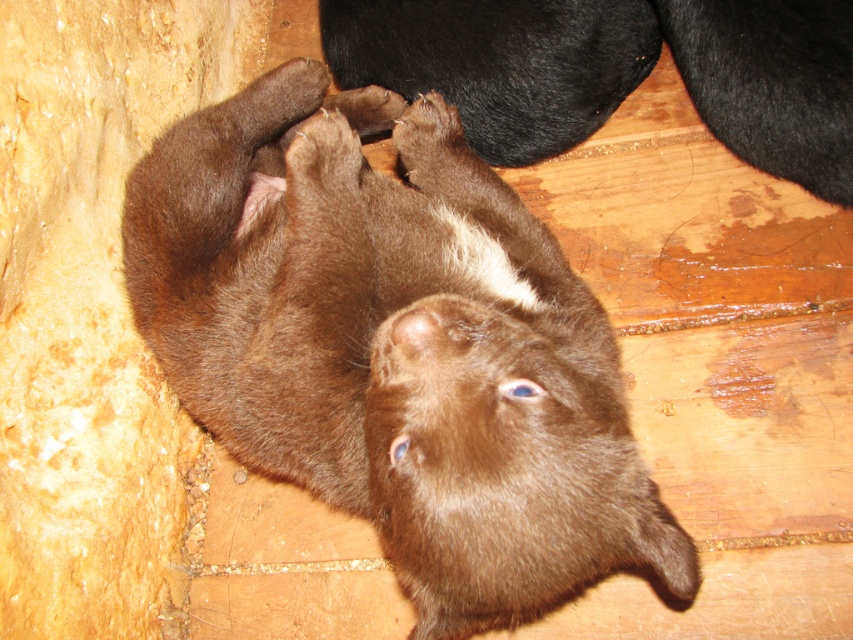
You are a dog trainer observing the scene. You notice the brown furry bear cub at center and the brown fur at upper center. Which object is bigger in size?

The brown furry bear cub at center is larger in size compared to the brown fur at upper center.

You are a robot trying to navigate to the puppy. You see two points marked in the image. The first point is at coordinate point (473,493) and the second point is at coordinate point (509,8). Which point should you move towards to get closer to the puppy?

Point (473,493) is in front of point (509,8), so you should move towards point (473,493) to get closer to the puppy.

You are observing a scene where a brown furry bear cub at center and brown fur at upper center are present. Which object has a smaller width?

The brown furry bear cub at center has a lesser width compared to the brown fur at upper center.